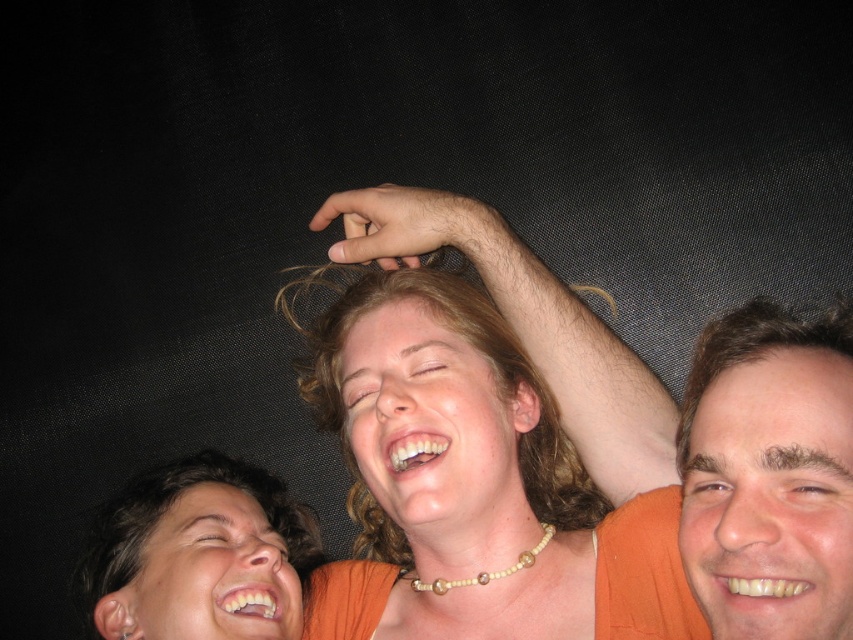
You are a photographer trying to adjust lighting for a group photo. You notice the orange fabric shirt at center and the smooth skin face at upper right. Which object should you focus on to ensure proper exposure since it is larger in the frame?

The orange fabric shirt at center is taller than the smooth skin face at upper right, so you should focus on the orange fabric shirt at center for proper exposure as it is larger in the frame.

You are a photographer trying to capture a candid shot of the orange fabric shirt at center and the smooth skin face at upper right. Based on their sizes in the frame, which object would you focus on first to ensure both are in the shot?

The orange fabric shirt at center is wider than the smooth skin face at upper right, so focusing on the orange fabric shirt at center first would ensure both are in the shot since it occupies more space in the frame.